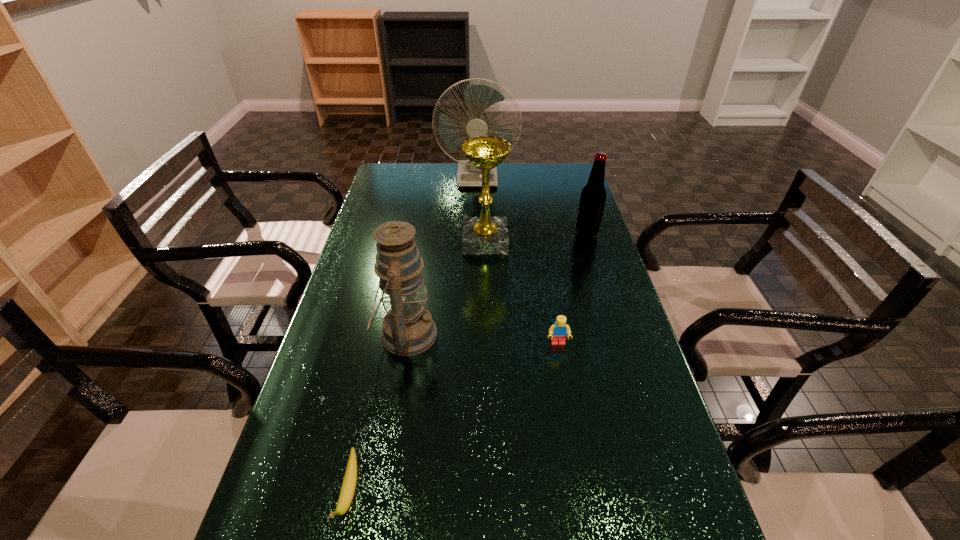
At what (x,y) coordinates should I click in order to perform the action: click on blank space located 0.350m on the front-facing side of the fan. Please return your answer as a coordinate pair (x, y). This screenshot has height=540, width=960. Looking at the image, I should click on (477, 241).

The image size is (960, 540). I want to click on vacant area located 0.280m on the back of the oil lamp, so click(x=420, y=247).

Image resolution: width=960 pixels, height=540 pixels. In order to click on vacant space located 0.340m on the front-facing side of the award in this screenshot , I will do `click(364, 241)`.

This screenshot has height=540, width=960. What are the coordinates of `vacant space situated 0.210m on the front-facing side of the award` in the screenshot? It's located at coord(402,241).

Where is `vacant region located on the front-facing side of the award`? The image size is (960, 540). vacant region located on the front-facing side of the award is located at coordinates (417, 241).

Identify the location of vacant space located 0.330m on the front of the rightmost object. (611, 308).

Where is `vacant space situated 0.340m on the front-facing side of the second shortest object`? Image resolution: width=960 pixels, height=540 pixels. vacant space situated 0.340m on the front-facing side of the second shortest object is located at coordinates (581, 477).

Find the location of a particular element. The height and width of the screenshot is (540, 960). object at the far edge is located at coordinates tap(478, 98).

Find the location of `oil lamp present at the left edge`. oil lamp present at the left edge is located at coordinates (408, 329).

Identify the location of banana at the left edge. (347, 492).